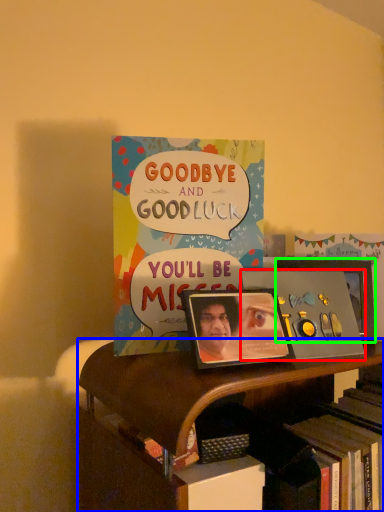
Question: Estimate the real-world distances between objects in this image. Which object is farther from album cover (highlighted by a red box), bookcase (highlighted by a blue box) or picture frame (highlighted by a green box)?

Choices:
 (A) bookcase
 (B) picture frame

Answer: (A)